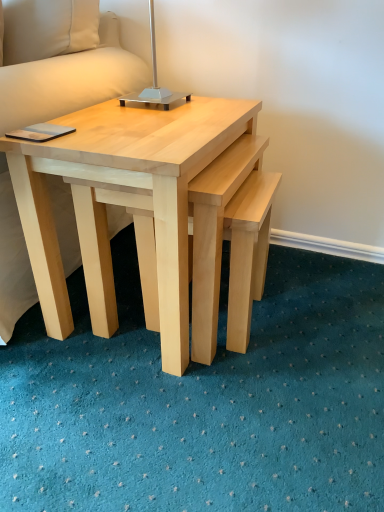
Question: Is metallic silver table lamp at upper center facing towards natural wood coffee table at center?

Choices:
 (A) no
 (B) yes

Answer: (A)

Question: From the image's perspective, is metallic silver table lamp at upper center over natural wood coffee table at center?

Choices:
 (A) yes
 (B) no

Answer: (A)

Question: Does metallic silver table lamp at upper center appear on the left side of natural wood coffee table at center?

Choices:
 (A) no
 (B) yes

Answer: (B)

Question: Can you confirm if metallic silver table lamp at upper center is shorter than natural wood coffee table at center?

Choices:
 (A) no
 (B) yes

Answer: (B)

Question: Is metallic silver table lamp at upper center further to camera compared to natural wood coffee table at center?

Choices:
 (A) yes
 (B) no

Answer: (A)

Question: Is point (81, 230) positioned closer to the camera than point (155, 91)?

Choices:
 (A) closer
 (B) farther

Answer: (A)

Question: Is natural wood coffee table at center inside or outside of metallic silver table lamp at upper center?

Choices:
 (A) inside
 (B) outside

Answer: (B)

Question: From the image's perspective, relative to metallic silver table lamp at upper center, is natural wood coffee table at center above or below?

Choices:
 (A) below
 (B) above

Answer: (A)

Question: In the image, is natural wood coffee table at center on the left side or the right side of metallic silver table lamp at upper center?

Choices:
 (A) right
 (B) left

Answer: (A)

Question: In the image, is white fabric pillow at upper left on the left side or the right side of natural wood coffee table at center?

Choices:
 (A) right
 (B) left

Answer: (B)

Question: Is point (41, 0) positioned closer to the camera than point (187, 270)?

Choices:
 (A) closer
 (B) farther

Answer: (B)

Question: From their relative heights in the image, would you say white fabric pillow at upper left is taller or shorter than natural wood coffee table at center?

Choices:
 (A) tall
 (B) short

Answer: (B)

Question: Looking at the image, does white fabric pillow at upper left seem bigger or smaller compared to natural wood coffee table at center?

Choices:
 (A) small
 (B) big

Answer: (A)

Question: From the image's perspective, is metallic silver table lamp at upper center positioned above or below white fabric pillow at upper left?

Choices:
 (A) above
 (B) below

Answer: (B)

Question: From a real-world perspective, is metallic silver table lamp at upper center physically located above or below white fabric pillow at upper left?

Choices:
 (A) above
 (B) below

Answer: (B)